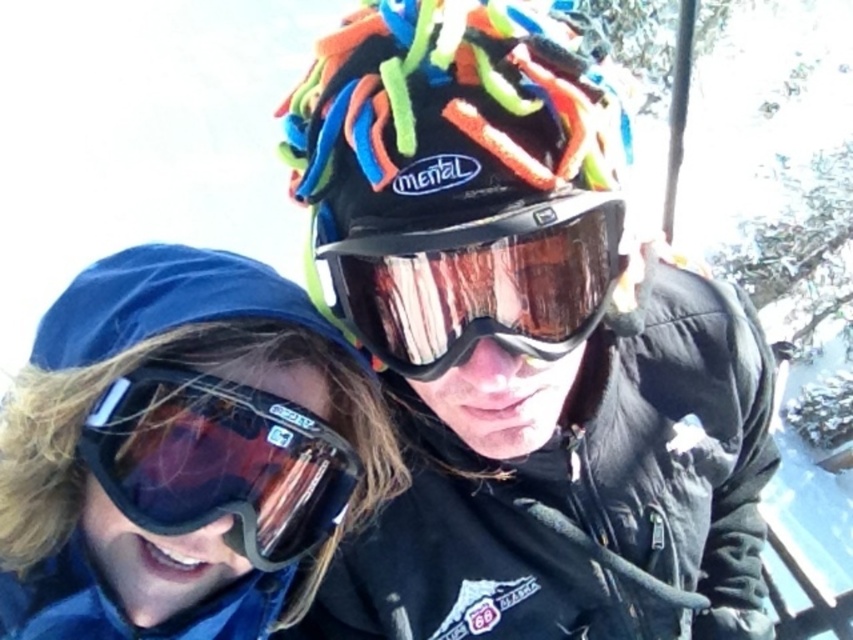
Who is positioned more to the left, transparent plastic goggles at lower left or transparent reflective goggles at center?

Positioned to the left is transparent plastic goggles at lower left.

In the scene shown: Who is higher up, transparent plastic goggles at lower left or transparent reflective goggles at center?

transparent reflective goggles at center is higher up.

Between point (193, 529) and point (430, 340), which one is positioned in front?

Point (430, 340) is in front.

Where is `transparent plastic goggles at lower left`? The width and height of the screenshot is (853, 640). transparent plastic goggles at lower left is located at coordinates (218, 461).

Can you confirm if multicolored knit beanie at center is positioned below transparent reflective goggles at center?

Answer: Yes.

Who is lower down, multicolored knit beanie at center or transparent reflective goggles at center?

Positioned lower is multicolored knit beanie at center.

Measure the distance between multicolored knit beanie at center and camera.

The distance of multicolored knit beanie at center from camera is 34.85 inches.

The height and width of the screenshot is (640, 853). I want to click on multicolored knit beanie at center, so 523,342.

Which is above, multicolored knit beanie at center or transparent plastic goggles at lower left?

transparent plastic goggles at lower left is higher up.

Who is positioned more to the left, multicolored knit beanie at center or transparent plastic goggles at lower left?

Positioned to the left is transparent plastic goggles at lower left.

Between point (662, 364) and point (312, 536), which one is positioned in front?

Positioned in front is point (312, 536).

Find the location of `multicolored knit beanie at center`. multicolored knit beanie at center is located at coordinates (523, 342).